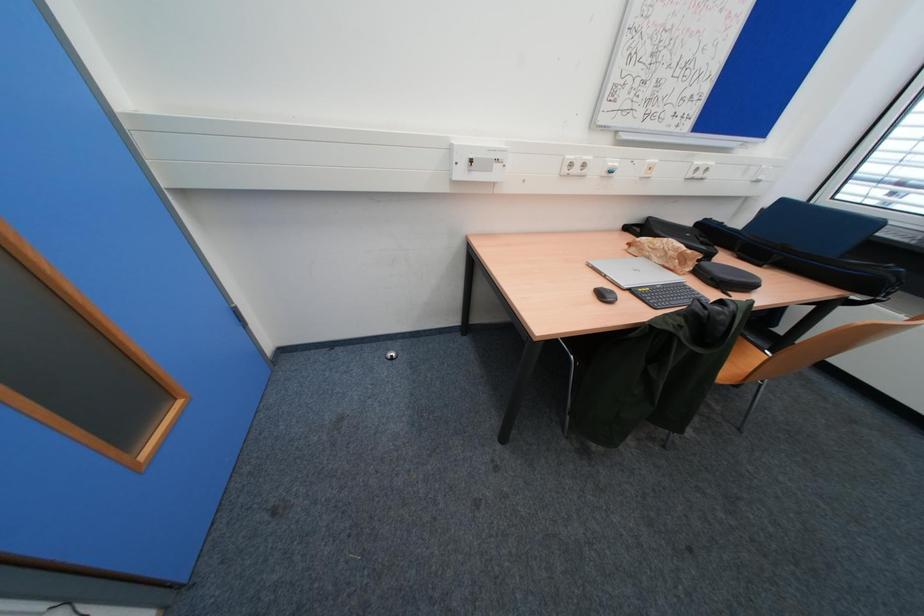
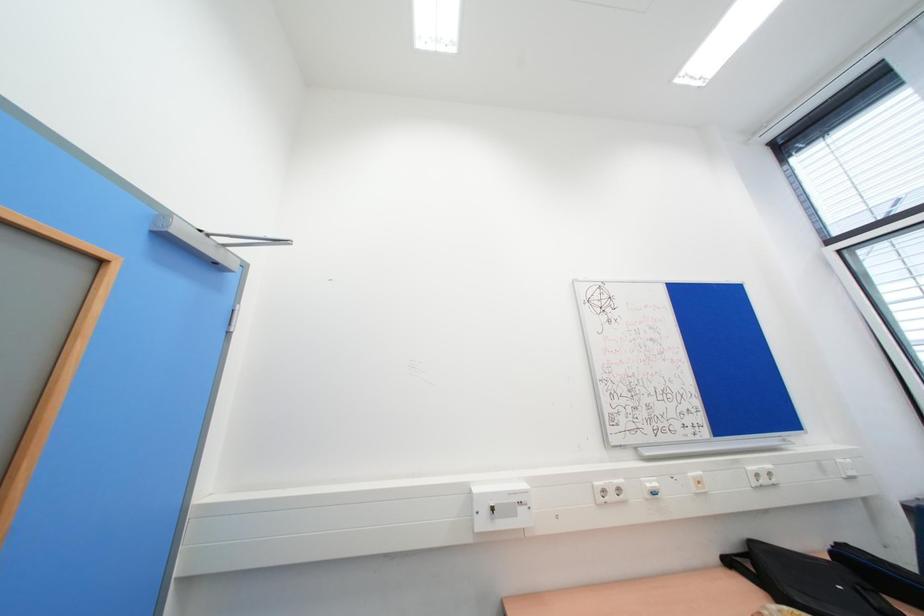
Question: The images are taken continuously from a first-person perspective. In which direction is your viewpoint rotating?

Choices:
 (A) Left
 (B) Right
 (C) Up
 (D) Down

Answer: (C)